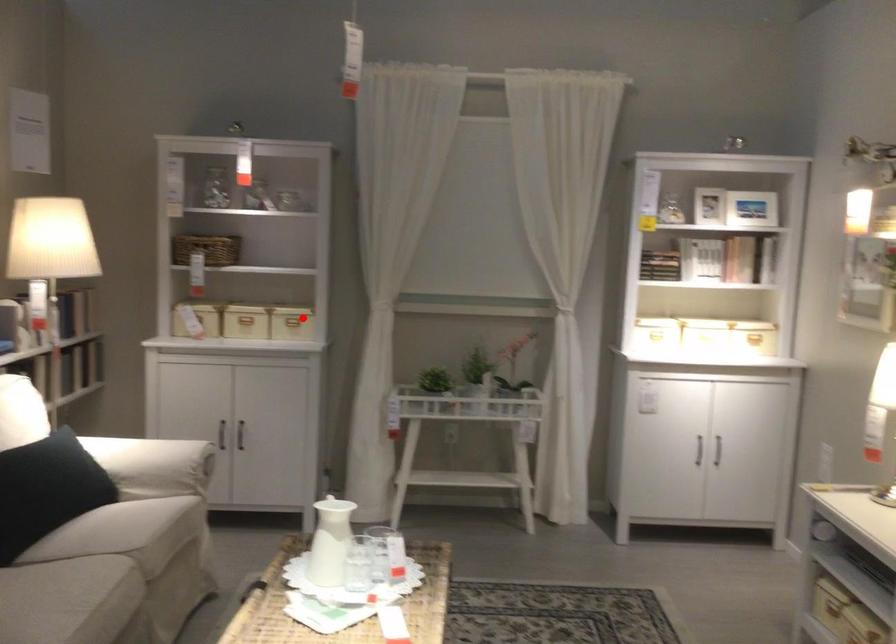
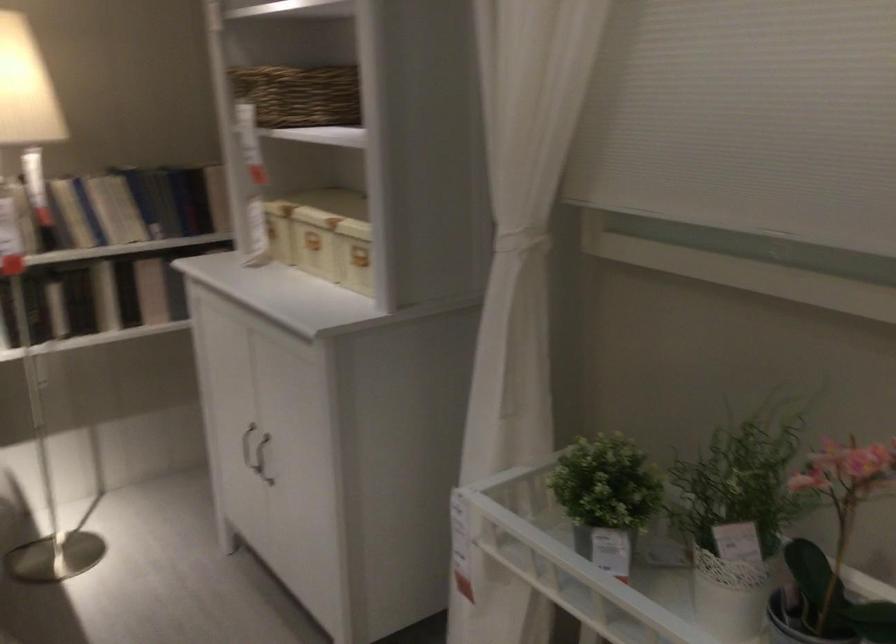
Question: I am providing you with two images of the same scene from different viewpoints. Given a red point in image1, look at the same physical point in image2. Is it:

Choices:
 (A) Closer to the viewpoint
 (B) Farther from the viewpoint

Answer: (A)